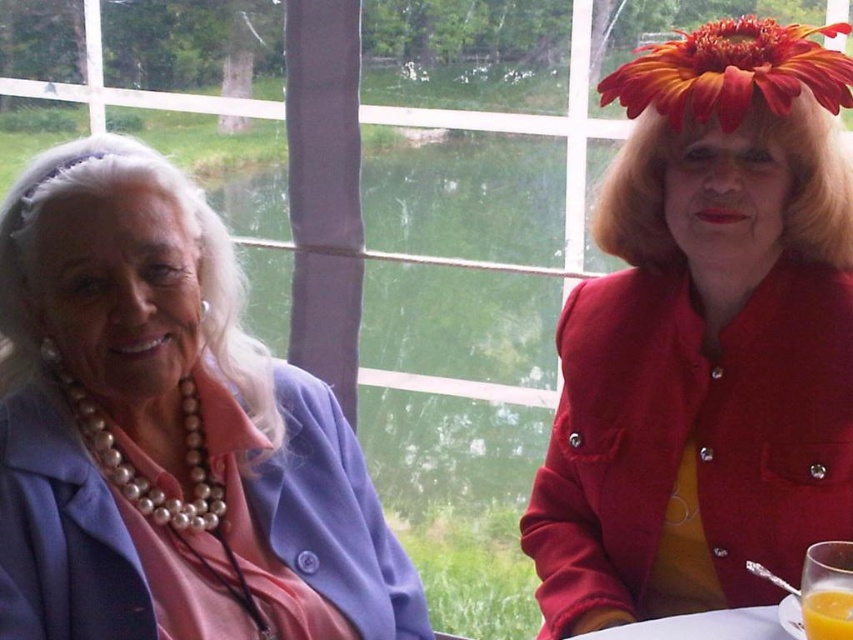
Does matte red coat at right have a lesser width compared to pearl necklace at left?

Yes, matte red coat at right is thinner than pearl necklace at left.

Does point (741, 81) come farther from viewer compared to point (190, 621)?

Yes, it is behind point (190, 621).

Locate an element on the screen. matte red coat at right is located at coordinates pos(705,339).

Can you confirm if pearl necklace at left is taller than translucent glass cup at lower right?

Yes, pearl necklace at left is taller than translucent glass cup at lower right.

Which is in front, point (303, 502) or point (805, 630)?

Point (805, 630)

At what (x,y) coordinates should I click in order to perform the action: click on pearl necklace at left. Please return your answer as a coordinate pair (x, y). Looking at the image, I should click on (167, 432).

In the scene shown: Who is taller, matte red coat at right or translucent glass cup at lower right?

matte red coat at right is taller.

Does matte red coat at right have a larger size compared to translucent glass cup at lower right?

Correct, matte red coat at right is larger in size than translucent glass cup at lower right.

What do you see at coordinates (705, 339) in the screenshot? This screenshot has height=640, width=853. I see `matte red coat at right` at bounding box center [705, 339].

Find the location of a particular element. This screenshot has width=853, height=640. matte red coat at right is located at coordinates (705, 339).